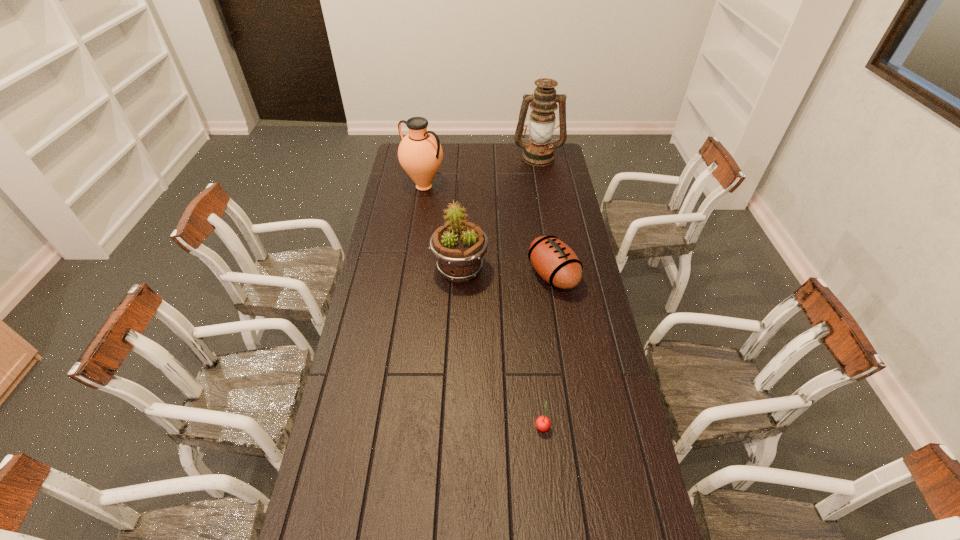
I want to click on free space that is in between the nearest object and the flowerpot, so click(x=501, y=348).

This screenshot has height=540, width=960. I want to click on vacant space that's between the football (American) and the flowerpot, so click(507, 273).

This screenshot has height=540, width=960. What are the coordinates of `free area in between the farthest object and the shortest object` in the screenshot? It's located at (540, 291).

Identify the location of vacant area between the tallest object and the flowerpot. (499, 213).

Where is `empty location between the fourth tallest object and the cherry`? The image size is (960, 540). empty location between the fourth tallest object and the cherry is located at coordinates (547, 350).

Locate an element on the screen. This screenshot has height=540, width=960. free space between the lantern and the football (American) is located at coordinates (545, 216).

Where is `vacant area between the football (American) and the cherry`? vacant area between the football (American) and the cherry is located at coordinates (547, 350).

Image resolution: width=960 pixels, height=540 pixels. In order to click on free space between the farthest object and the pitcher in this screenshot , I will do `click(481, 172)`.

The image size is (960, 540). In order to click on empty location between the farthest object and the pitcher in this screenshot , I will do `click(481, 172)`.

I want to click on object that is the second closest one to the cherry, so click(x=459, y=246).